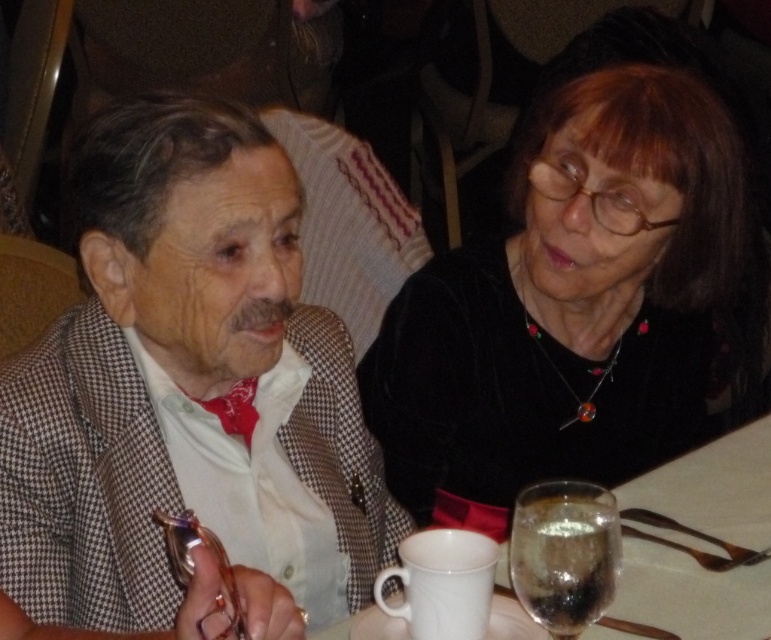
Question: Among these points, which one is farthest from the camera?

Choices:
 (A) (604, 540)
 (B) (352, 371)

Answer: (B)

Question: Is black velvet sweater at upper right to the left of white ceramic mug at lower center from the viewer's perspective?

Choices:
 (A) yes
 (B) no

Answer: (A)

Question: Where is black velvet sweater at upper right located in relation to white ceramic mug at lower center in the image?

Choices:
 (A) right
 (B) left

Answer: (B)

Question: Which of the following is the farthest from the observer?

Choices:
 (A) (35, 416)
 (B) (699, 392)

Answer: (B)

Question: Which object is closer to the camera taking this photo?

Choices:
 (A) white ceramic mug at lower center
 (B) checkered fabric suit at left
 (C) black velvet sweater at upper right
 (D) clear glass wine glass at lower right

Answer: (B)

Question: Is the position of checkered fabric suit at left less distant than that of white ceramic mug at lower center?

Choices:
 (A) yes
 (B) no

Answer: (A)